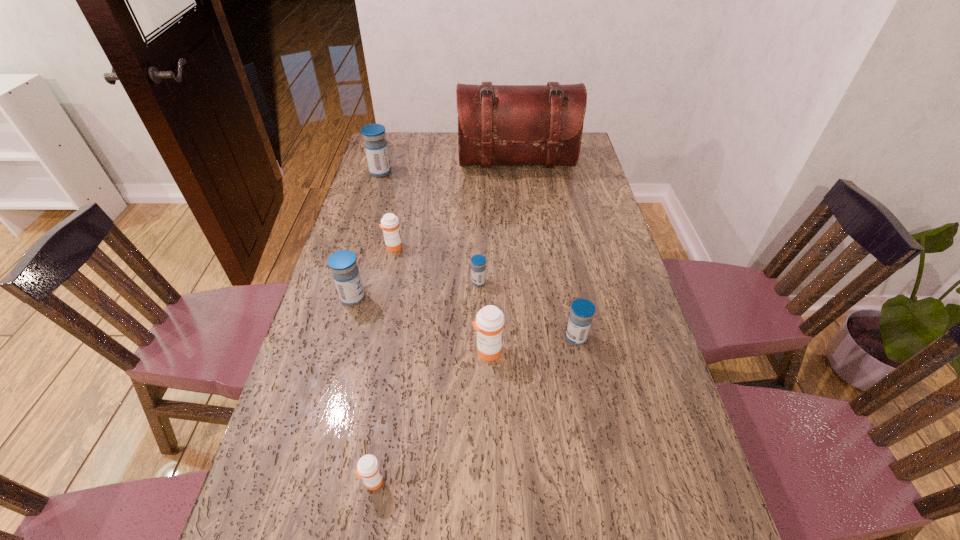
At what (x,y) coordinates should I click in order to perform the action: click on brown satchel. Please return your answer as a coordinate pair (x, y). Looking at the image, I should click on (497, 124).

This screenshot has width=960, height=540. Find the location of `the tallest object`. the tallest object is located at coordinates (497, 124).

Locate an element on the screen. The height and width of the screenshot is (540, 960). the tallest medicine is located at coordinates (375, 144).

Locate an element on the screen. The width and height of the screenshot is (960, 540). the farthest medicine is located at coordinates (375, 144).

The width and height of the screenshot is (960, 540). Identify the location of the biggest orange medicine. (489, 323).

Where is `the second farthest orange medicine`? This screenshot has height=540, width=960. the second farthest orange medicine is located at coordinates tap(489, 323).

You are a GUI agent. You are given a task and a screenshot of the screen. Output one action in this format:
    pyautogui.click(x=<x>, y=<y>)
    Task: Click on the fourth nearest object
    This screenshot has height=540, width=960.
    Given the screenshot: What is the action you would take?
    pyautogui.click(x=342, y=263)

The image size is (960, 540). In order to click on the second biggest blue medicine in this screenshot , I will do `click(342, 263)`.

Image resolution: width=960 pixels, height=540 pixels. I want to click on the sixth nearest medicine, so click(x=389, y=223).

Where is `the third object from left to right`? The height and width of the screenshot is (540, 960). the third object from left to right is located at coordinates (389, 223).